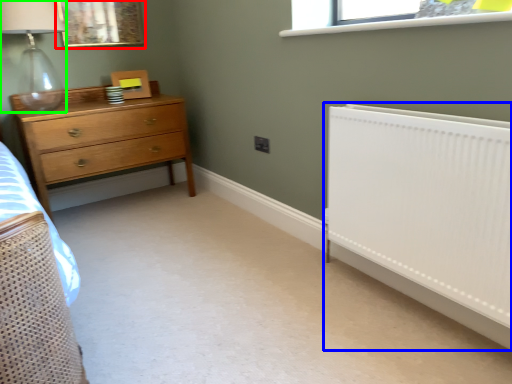
Question: Considering the real-world distances, which object is closest to picture frame (highlighted by a red box)? radiator (highlighted by a blue box) or lamp (highlighted by a green box).

Choices:
 (A) radiator
 (B) lamp

Answer: (B)